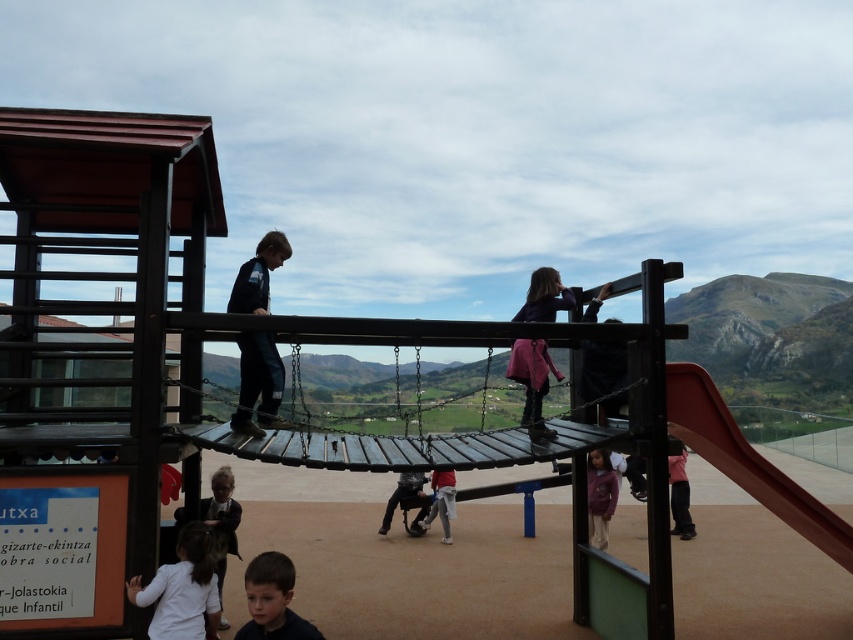
Does pink fabric pants at lower right appear on the left side of dark gray fabric pants at center?

In fact, pink fabric pants at lower right is to the right of dark gray fabric pants at center.

Can you confirm if pink fabric pants at lower right is shorter than dark gray fabric pants at center?

In fact, pink fabric pants at lower right may be taller than dark gray fabric pants at center.

Between point (676, 520) and point (416, 472), which one is positioned in front?

Positioned in front is point (416, 472).

The width and height of the screenshot is (853, 640). What are the coordinates of `pink fabric pants at lower right` in the screenshot? It's located at (679, 497).

Looking at this image, can you confirm if dark blue hair at lower center is thinner than white fabric shirt at lower left?

Yes.

Which is above, dark blue hair at lower center or white fabric shirt at lower left?

Positioned higher is dark blue hair at lower center.

This screenshot has width=853, height=640. I want to click on dark blue hair at lower center, so click(271, 600).

Find the location of a particular element. This screenshot has width=853, height=640. dark blue hair at lower center is located at coordinates click(x=271, y=600).

Is dark blue jeans at center smaller than pink fabric pants at lower right?

No.

Does point (274, 372) come in front of point (671, 506)?

That is True.

Find the location of a particular element. The height and width of the screenshot is (640, 853). dark blue jeans at center is located at coordinates (258, 384).